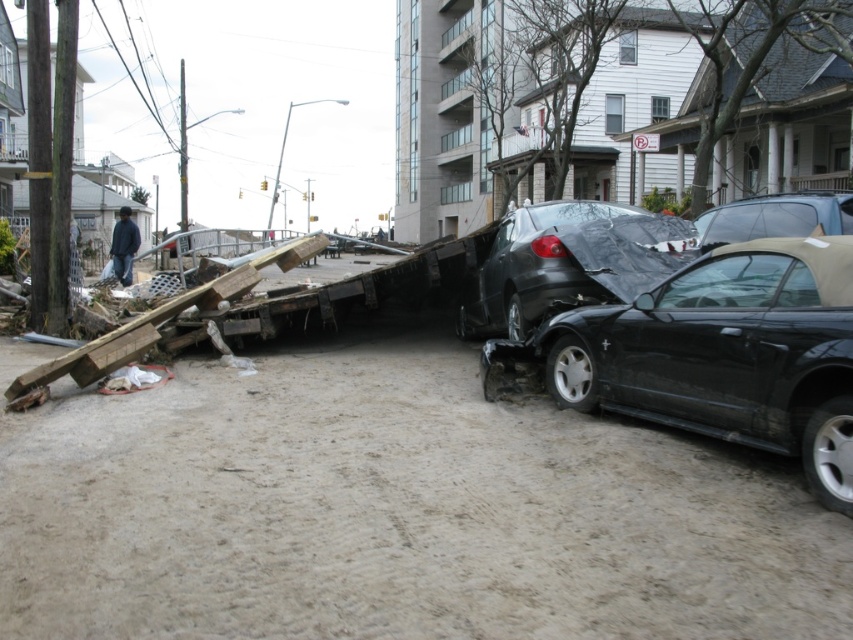
Between point (503, 330) and point (752, 212), which one is positioned in front?

Point (752, 212) is in front.

Can you confirm if black matte car at center is taller than matte black convertible at center?

Indeed, black matte car at center has a greater height compared to matte black convertible at center.

This screenshot has width=853, height=640. Identify the location of black matte car at center. (567, 262).

What do you see at coordinates (718, 355) in the screenshot? I see `black matte convertible at center` at bounding box center [718, 355].

Measure the distance between black matte convertible at center and matte black convertible at center.

4.71 meters

What do you see at coordinates (718, 355) in the screenshot? I see `black matte convertible at center` at bounding box center [718, 355].

Locate an element on the screen. Image resolution: width=853 pixels, height=640 pixels. black matte convertible at center is located at coordinates (718, 355).

Can you confirm if black matte convertible at center is taller than black matte car at center?

In fact, black matte convertible at center may be shorter than black matte car at center.

Between black matte convertible at center and black matte car at center, which one appears on the right side from the viewer's perspective?

Positioned to the right is black matte convertible at center.

Looking at this image, who is more distant from viewer, [822,262] or [535,305]?

The point [535,305] is behind.

You are a GUI agent. You are given a task and a screenshot of the screen. Output one action in this format:
    pyautogui.click(x=<x>, y=<y>)
    Task: Click on the black matte convertible at center
    
    Given the screenshot: What is the action you would take?
    pyautogui.click(x=718, y=355)